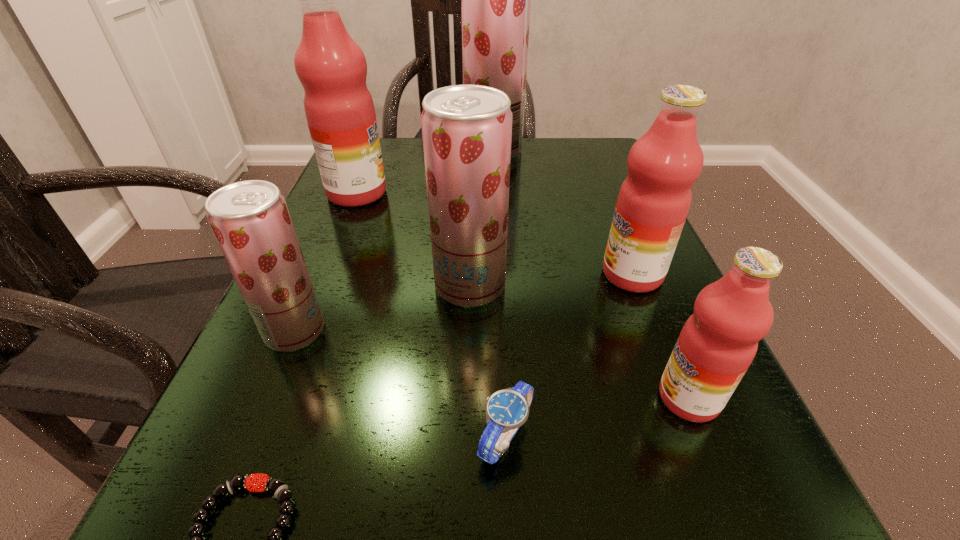
Where is `the farthest object`? the farthest object is located at coordinates (495, 0).

Where is `the biggest strawberry fruit juice`? This screenshot has width=960, height=540. the biggest strawberry fruit juice is located at coordinates (495, 0).

Locate an element on the screen. The width and height of the screenshot is (960, 540). the seventh nearest object is located at coordinates (332, 68).

At what (x,y) coordinates should I click in order to perform the action: click on the farthest pink fruit juice. Please return your answer as a coordinate pair (x, y). The height and width of the screenshot is (540, 960). Looking at the image, I should click on (332, 68).

The width and height of the screenshot is (960, 540). Find the location of `the second biggest strawberry fruit juice`. the second biggest strawberry fruit juice is located at coordinates (467, 129).

Where is `the second biggest pink fruit juice`? Image resolution: width=960 pixels, height=540 pixels. the second biggest pink fruit juice is located at coordinates (663, 164).

Identify the location of the nearest fruit juice. (718, 342).

Where is `the smallest pink fruit juice`? The width and height of the screenshot is (960, 540). the smallest pink fruit juice is located at coordinates (718, 342).

Identify the location of the fifth farthest fruit juice. (250, 220).

Identify the location of the fourth nearest object. (250, 220).